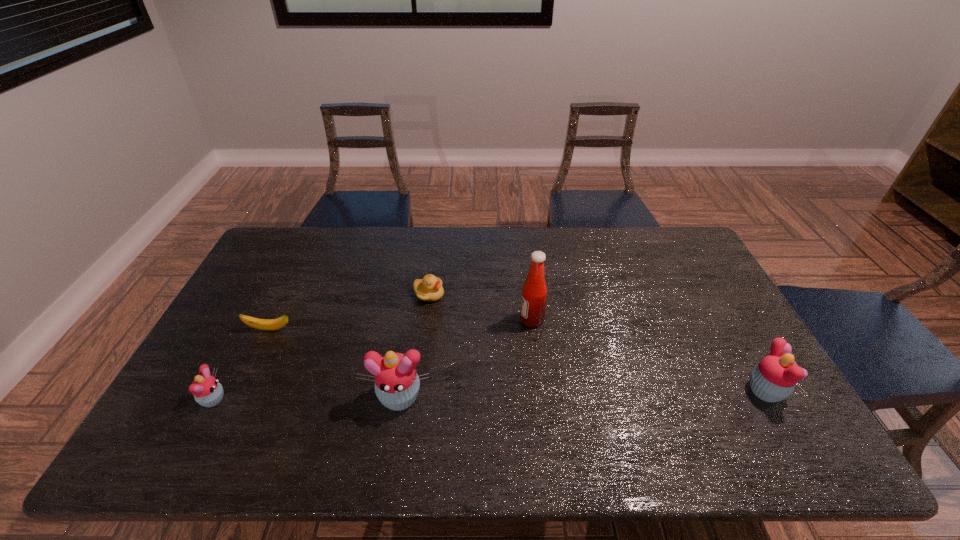
Locate an element on the screen. blank area in the image that satisfies the following two spatial constraints: 1. on the face of the second cupcake from left to right; 2. on the face of the shortest cupcake is located at coordinates (398, 400).